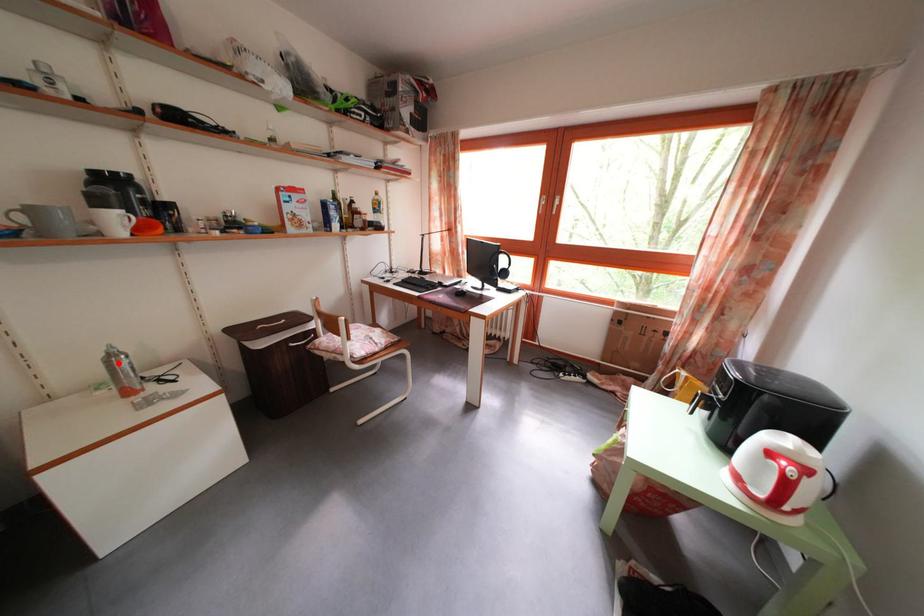
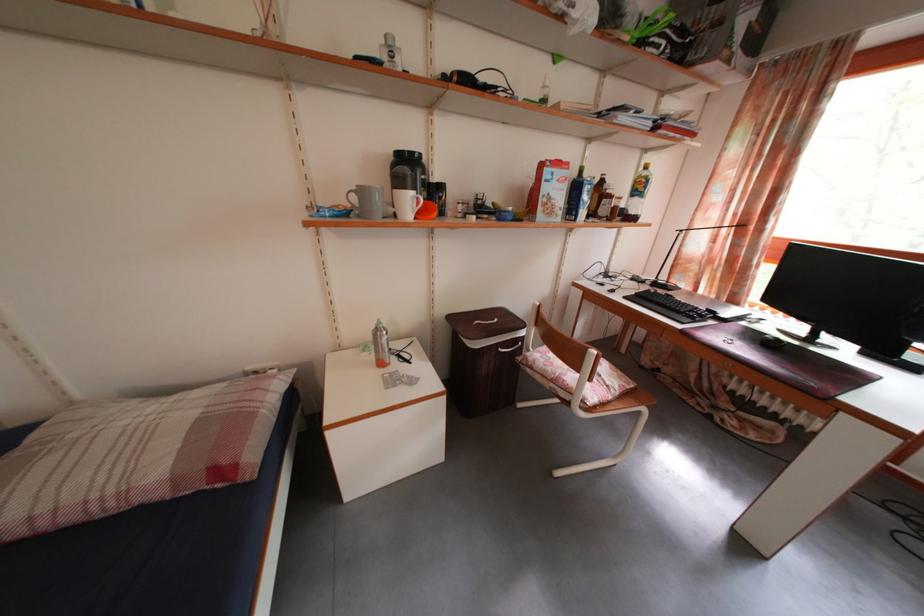
Question: I am providing you with two images of the same scene from different viewpoints. A red point is shown in image1. For the corresponding object point in image2, is it positioned nearer or farther from the camera?

Choices:
 (A) Nearer
 (B) Farther

Answer: (A)